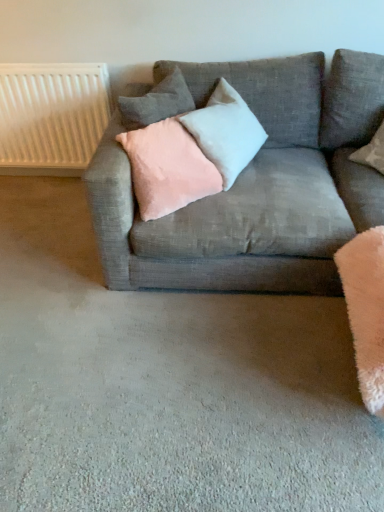
Describe the element at coordinates (255, 185) in the screenshot. I see `textured gray couch at center` at that location.

The width and height of the screenshot is (384, 512). Describe the element at coordinates (51, 117) in the screenshot. I see `white textured radiator at upper left` at that location.

Where is `pink velvet pillow at upper center, which appears as the first pillow when viewed from the top`? This screenshot has height=512, width=384. pink velvet pillow at upper center, which appears as the first pillow when viewed from the top is located at coordinates (157, 102).

Between point (176, 174) and point (50, 151), which one is positioned in front?

Positioned in front is point (176, 174).

In the scene shown: Is pink velvet pillow at center, marked as the first pillow in a bottom-to-top arrangement, not near white textured radiator at upper left?

No, pink velvet pillow at center, marked as the first pillow in a bottom-to-top arrangement, is in close proximity to white textured radiator at upper left.

Is pink velvet pillow at center, marked as the first pillow in a bottom-to-top arrangement, positioned with its back to white textured radiator at upper left?

That's right, pink velvet pillow at center, marked as the first pillow in a bottom-to-top arrangement, is facing away from white textured radiator at upper left.

From a real-world perspective, between pink velvet pillow at center, which is the third pillow in top-to-bottom order, and white textured radiator at upper left, who is vertically higher?

In real-world perspective, pink velvet pillow at center, which is the third pillow in top-to-bottom order, is above.

Find the location of a particular element. the 1st pillow below when counting from the pink velvet pillow at upper center, which appears as the first pillow when viewed from the top (from the image's perspective) is located at coordinates (226, 131).

From the image's perspective, is satin light gray pillow at center, acting as the second pillow starting from the top, over pink velvet pillow at upper center, which is the 3th pillow in bottom-to-top order?

No, from the image's perspective, satin light gray pillow at center, acting as the second pillow starting from the top, is not on top of pink velvet pillow at upper center, which is the 3th pillow in bottom-to-top order.

Is satin light gray pillow at center, acting as the second pillow starting from the top, wider or thinner than pink velvet pillow at upper center, which appears as the first pillow when viewed from the top?

Clearly, satin light gray pillow at center, acting as the second pillow starting from the top, has less width compared to pink velvet pillow at upper center, which appears as the first pillow when viewed from the top.

Is satin light gray pillow at center, which is the second pillow from bottom to top, spatially inside pink velvet pillow at upper center, which appears as the first pillow when viewed from the top, or outside of it?

satin light gray pillow at center, which is the second pillow from bottom to top, is spatially situated outside pink velvet pillow at upper center, which appears as the first pillow when viewed from the top.

From a real-world perspective, is white textured radiator at upper left below pink velvet pillow at center, marked as the first pillow in a bottom-to-top arrangement?

Yes.

Could you tell me if white textured radiator at upper left is turned towards pink velvet pillow at center, which is the third pillow in top-to-bottom order?

No, white textured radiator at upper left does not turn towards pink velvet pillow at center, which is the third pillow in top-to-bottom order.

Between white textured radiator at upper left and pink velvet pillow at center, which is the third pillow in top-to-bottom order, which one appears on the right side from the viewer's perspective?

From the viewer's perspective, pink velvet pillow at center, which is the third pillow in top-to-bottom order, appears more on the right side.

Is white textured radiator at upper left in front of or behind pink velvet pillow at center, which is the third pillow in top-to-bottom order, in the image?

Clearly, white textured radiator at upper left is behind pink velvet pillow at center, which is the third pillow in top-to-bottom order.

Considering the positions of objects satin light gray pillow at center, acting as the second pillow starting from the top, and white textured radiator at upper left in the image provided, who is in front, satin light gray pillow at center, acting as the second pillow starting from the top, or white textured radiator at upper left?

satin light gray pillow at center, acting as the second pillow starting from the top, is closer to the camera.

Is the surface of satin light gray pillow at center, which is the second pillow from bottom to top, in direct contact with white textured radiator at upper left?

satin light gray pillow at center, which is the second pillow from bottom to top, is not next to white textured radiator at upper left, and they're not touching.

Is satin light gray pillow at center, which is the second pillow from bottom to top, turned away from white textured radiator at upper left?

No, satin light gray pillow at center, which is the second pillow from bottom to top, is not facing away from white textured radiator at upper left.

Is textured gray couch at center surrounded by satin light gray pillow at center, acting as the second pillow starting from the top?

Actually, textured gray couch at center is outside satin light gray pillow at center, acting as the second pillow starting from the top.

Which is farther, (241, 126) or (241, 187)?

Positioned behind is point (241, 187).

From a real-world perspective, between satin light gray pillow at center, acting as the second pillow starting from the top, and textured gray couch at center, who is vertically higher?

From a 3D spatial view, satin light gray pillow at center, acting as the second pillow starting from the top, is above.

Which of these two, satin light gray pillow at center, acting as the second pillow starting from the top, or textured gray couch at center, stands taller?

textured gray couch at center is taller.

Which of these two, white textured radiator at upper left or textured gray couch at center, stands shorter?

Standing shorter between the two is white textured radiator at upper left.

In the scene shown: From the image's perspective, relative to textured gray couch at center, is white textured radiator at upper left above or below?

Based on their image positions, white textured radiator at upper left is located above textured gray couch at center.

Consider the image. Which of these two, white textured radiator at upper left or textured gray couch at center, is wider?

textured gray couch at center is wider.

Considering the sizes of objects white textured radiator at upper left and textured gray couch at center in the image provided, who is bigger, white textured radiator at upper left or textured gray couch at center?

With larger size is textured gray couch at center.

Which of these two, pink velvet pillow at upper center, which is the 3th pillow in bottom-to-top order, or satin light gray pillow at center, which is the second pillow from bottom to top, is smaller?

With smaller size is pink velvet pillow at upper center, which is the 3th pillow in bottom-to-top order.

Which is behind, pink velvet pillow at upper center, which appears as the first pillow when viewed from the top, or satin light gray pillow at center, acting as the second pillow starting from the top?

satin light gray pillow at center, acting as the second pillow starting from the top, is more distant.

From the picture: Would you say pink velvet pillow at upper center, which appears as the first pillow when viewed from the top, is to the left or to the right of satin light gray pillow at center, which is the second pillow from bottom to top, in the picture?

From the image, it's evident that pink velvet pillow at upper center, which appears as the first pillow when viewed from the top, is to the left of satin light gray pillow at center, which is the second pillow from bottom to top.

Could you tell me if pink velvet pillow at upper center, which appears as the first pillow when viewed from the top, is facing satin light gray pillow at center, which is the second pillow from bottom to top?

No, pink velvet pillow at upper center, which appears as the first pillow when viewed from the top, is not aimed at satin light gray pillow at center, which is the second pillow from bottom to top.

From the white textured radiator at upper left, count 3rd pillows forward and point to it. Please provide its 2D coordinates.

[(168, 168)]

Identify the location of pillow above the satin light gray pillow at center, which is the second pillow from bottom to top (from the image's perspective). (157, 102).

When comparing their distances from textured gray couch at center, does white textured radiator at upper left or pink velvet pillow at center, which is the third pillow in top-to-bottom order, seem further?

Among the two, white textured radiator at upper left is located further to textured gray couch at center.

Based on their spatial positions, is satin light gray pillow at center, acting as the second pillow starting from the top, or textured gray couch at center closer to pink velvet pillow at upper center, which is the 3th pillow in bottom-to-top order?

satin light gray pillow at center, acting as the second pillow starting from the top, is closer to pink velvet pillow at upper center, which is the 3th pillow in bottom-to-top order.

Looking at the image, which one is located further to pink velvet pillow at upper center, which is the 3th pillow in bottom-to-top order, pink velvet pillow at center, marked as the first pillow in a bottom-to-top arrangement, or white textured radiator at upper left?

Among the two, white textured radiator at upper left is located further to pink velvet pillow at upper center, which is the 3th pillow in bottom-to-top order.

Which object lies further to the anchor point white textured radiator at upper left, pink velvet pillow at upper center, which is the 3th pillow in bottom-to-top order, or satin light gray pillow at center, which is the second pillow from bottom to top?

Based on the image, satin light gray pillow at center, which is the second pillow from bottom to top, appears to be further to white textured radiator at upper left.

Estimate the real-world distances between objects in this image. Which object is closer to pink velvet pillow at center, which is the third pillow in top-to-bottom order, textured gray couch at center or white textured radiator at upper left?

textured gray couch at center lies closer to pink velvet pillow at center, which is the third pillow in top-to-bottom order, than the other object.

Which object lies further to the anchor point satin light gray pillow at center, which is the second pillow from bottom to top, pink velvet pillow at upper center, which appears as the first pillow when viewed from the top, or pink velvet pillow at center, which is the third pillow in top-to-bottom order?

Among the two, pink velvet pillow at upper center, which appears as the first pillow when viewed from the top, is located further to satin light gray pillow at center, which is the second pillow from bottom to top.

From the picture: When comparing their distances from pink velvet pillow at center, which is the third pillow in top-to-bottom order, does pink velvet pillow at upper center, which appears as the first pillow when viewed from the top, or textured gray couch at center seem further?

textured gray couch at center is positioned further to the anchor pink velvet pillow at center, which is the third pillow in top-to-bottom order.

Consider the image. Looking at the image, which one is located further to pink velvet pillow at upper center, which appears as the first pillow when viewed from the top, satin light gray pillow at center, acting as the second pillow starting from the top, or white textured radiator at upper left?

The object further to pink velvet pillow at upper center, which appears as the first pillow when viewed from the top, is white textured radiator at upper left.

You are a GUI agent. You are given a task and a screenshot of the screen. Output one action in this format:
    pyautogui.click(x=<x>, y=<y>)
    Task: Click on the pillow between white textured radiator at upper left and pink velvet pillow at center, marked as the first pillow in a bottom-to-top arrangement, in the horizontal direction
    This screenshot has height=512, width=384.
    Given the screenshot: What is the action you would take?
    pyautogui.click(x=157, y=102)

At what (x,y) coordinates should I click in order to perform the action: click on studio couch between white textured radiator at upper left and satin light gray pillow at center, which is the second pillow from bottom to top, in the horizontal direction. Please return your answer as a coordinate pair (x, y). Image resolution: width=384 pixels, height=512 pixels. Looking at the image, I should click on (255, 185).

The image size is (384, 512). Identify the location of studio couch between pink velvet pillow at upper center, which appears as the first pillow when viewed from the top, and pink velvet pillow at center, marked as the first pillow in a bottom-to-top arrangement, in the up-down direction. (255, 185).

This screenshot has height=512, width=384. I want to click on pillow between pink velvet pillow at upper center, which appears as the first pillow when viewed from the top, and pink velvet pillow at center, which is the third pillow in top-to-bottom order, in the up-down direction, so click(x=226, y=131).